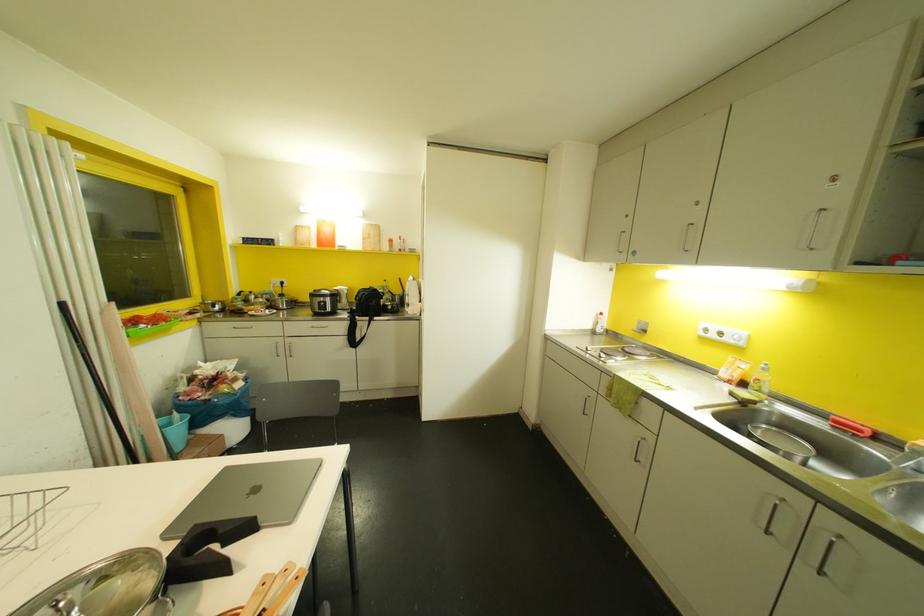
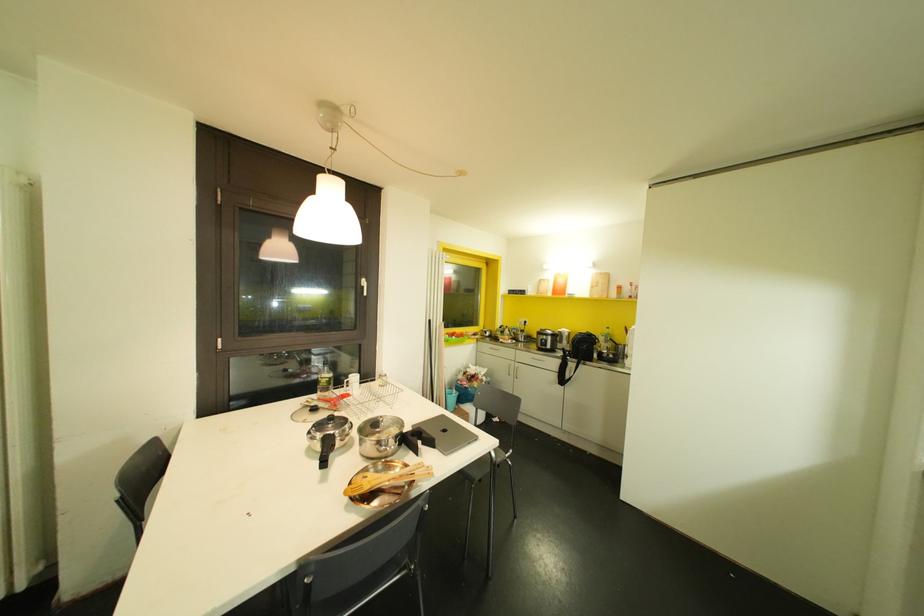
Question: The camera is either moving clockwise (left) or counter-clockwise (right) around the object. The first image is from the beginning of the video and the second image is from the end. Is the camera moving left or right when shooting the video?

Choices:
 (A) Left
 (B) Right

Answer: (B)